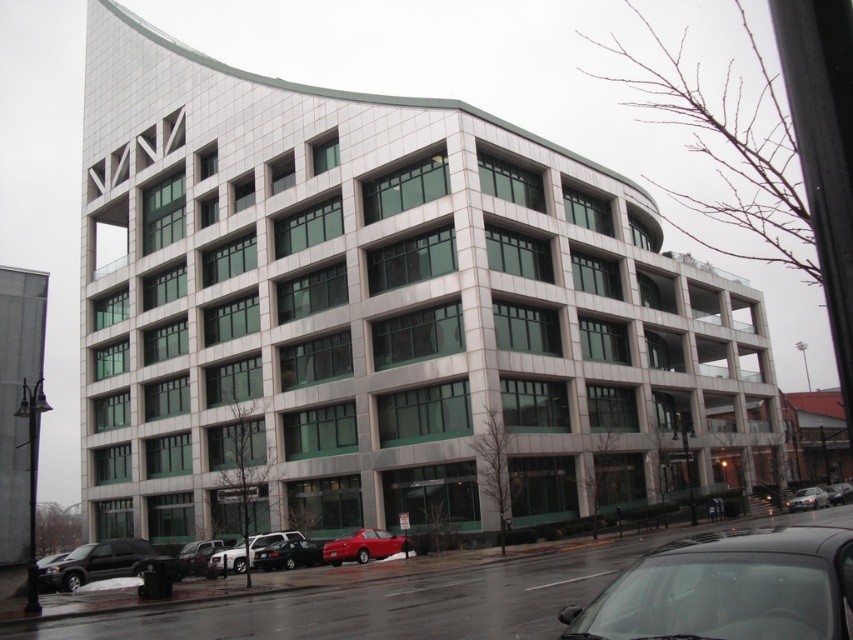
You are standing in front of the modern multi story building and want to locate the shiny red sedan at lower center. What are the coordinates where you can find it?

The shiny red sedan at lower center can be found at coordinates point [363,545].

You are standing in front of the modern multi story building and want to park your car. The shiny black car at lower right is currently occupying a spot. Is there enough space to park your car next to it without crossing the curb?

The shiny black car at lower right is located at point (728, 588). Since the exact dimensions of the parking space and the distance between the car and the curb are not provided, it is unclear if there is enough space to park next to it without crossing the curb. More information is needed to determine this.

You are a delivery person standing at the entrance of the building. You need to place a package on the shiny black car at lower right. The package is 3.5 meters long. Can you place the package on the car without moving it?

The distance between you and the shiny black car at lower right is 3.46 meters. Since the package is 3.5 meters long, it would not fit in the available space. You would need to move the car to accommodate the package.